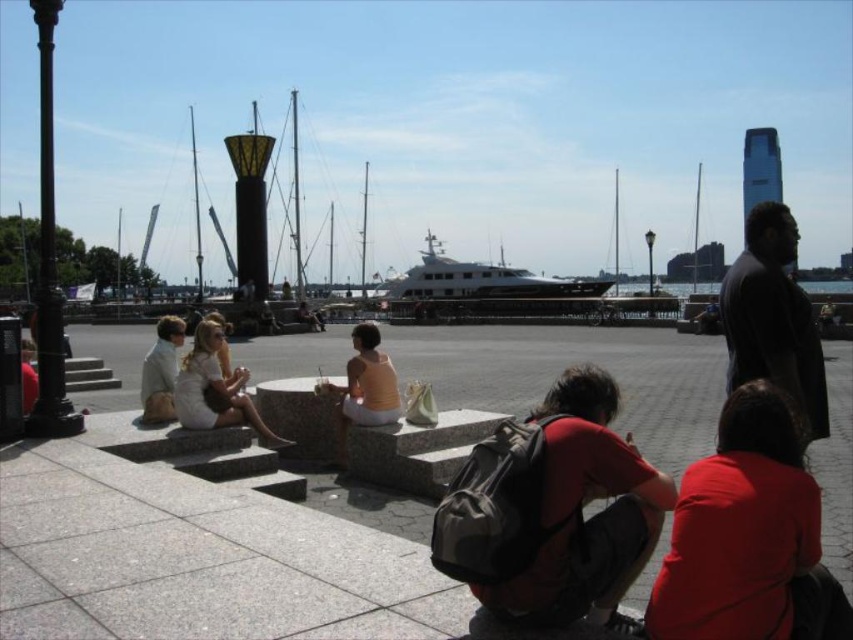
Question: Can you confirm if dark gray coat at right is bigger than white glossy yacht at center?

Choices:
 (A) no
 (B) yes

Answer: (A)

Question: Which point appears closest to the camera in this image?

Choices:
 (A) (463, 308)
 (B) (357, 408)
 (C) (746, 371)

Answer: (C)

Question: Among these points, which one is farthest from the camera?

Choices:
 (A) (519, 589)
 (B) (357, 330)

Answer: (B)

Question: Which of the following is the farthest from the observer?

Choices:
 (A) matte orange tank top at center
 (B) matte red shirt at lower right
 (C) white cotton dress at center
 (D) white glossy yacht at center

Answer: (D)

Question: Does matte red shirt at lower right appear under white cotton dress at center?

Choices:
 (A) yes
 (B) no

Answer: (B)

Question: Can you confirm if matte red shirt at lower right is smaller than white glossy yacht at center?

Choices:
 (A) yes
 (B) no

Answer: (A)